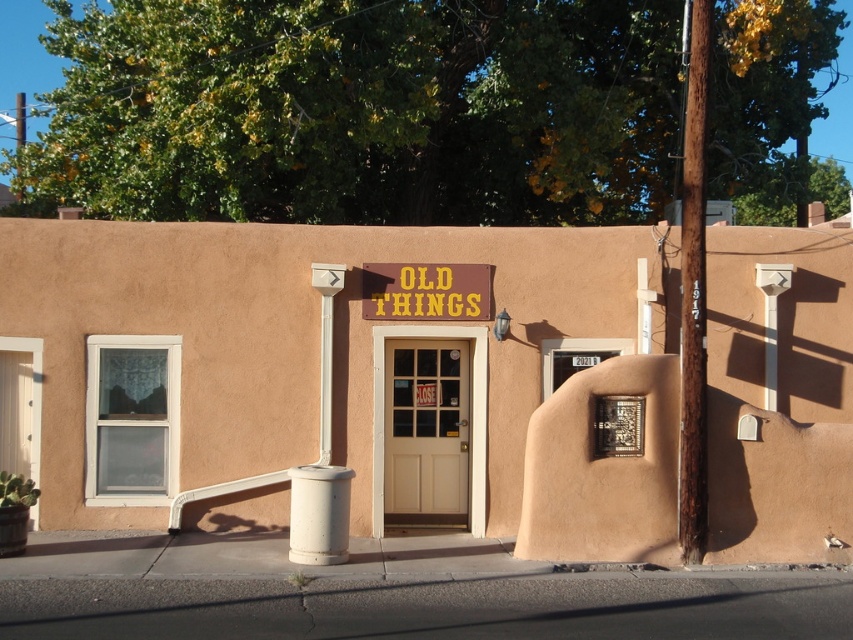
Can you confirm if matte beige building at center is taller than brown wooden sign at center?

No, matte beige building at center is not taller than brown wooden sign at center.

Between matte beige building at center and brown wooden sign at center, which one appears on the right side from the viewer's perspective?

brown wooden sign at center is more to the right.

Where is `matte beige building at center`? The width and height of the screenshot is (853, 640). matte beige building at center is located at coordinates (318, 372).

Where is `matte beige building at center`? matte beige building at center is located at coordinates (318, 372).

Is matte beige building at center below white wood door at center?

No.

Image resolution: width=853 pixels, height=640 pixels. What are the coordinates of `matte beige building at center` in the screenshot? It's located at (318, 372).

Which is behind, point (395, 406) or point (393, 305)?

Point (395, 406)

Can you confirm if white wood door at center is taller than brown wooden sign at center?

Yes, white wood door at center is taller than brown wooden sign at center.

Does point (445, 355) come behind point (387, 284)?

Yes, it is behind point (387, 284).

Identify the location of white wood door at center. (425, 433).